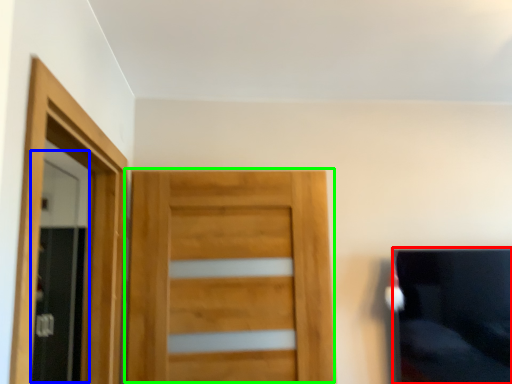
Question: Estimate the real-world distances between objects in this image. Which object is closer to couch (highlighted by a red box), screen door (highlighted by a blue box) or door (highlighted by a green box)?

Choices:
 (A) screen door
 (B) door

Answer: (B)